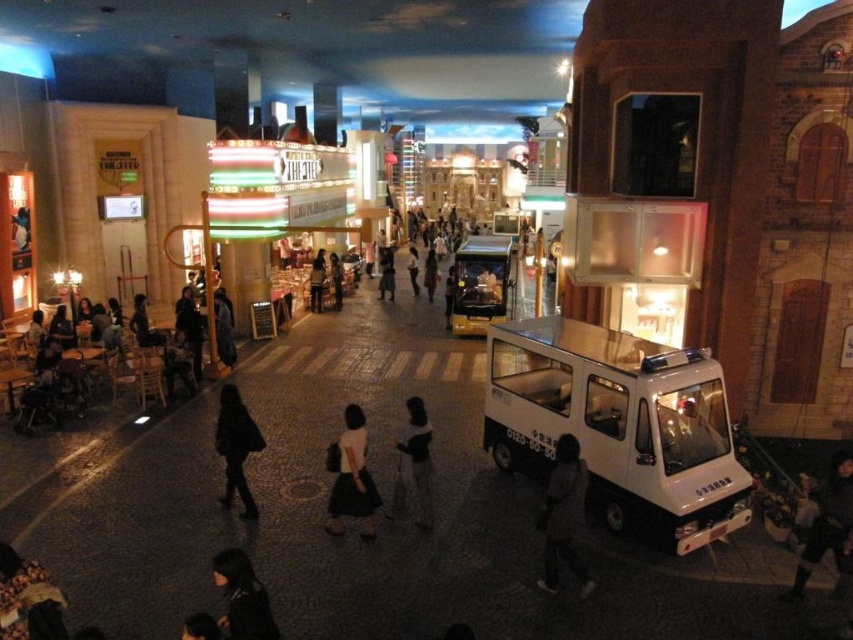
Question: Considering the real-world distances, which object is closest to the white plastic food truck at center?

Choices:
 (A) white matte skirt at center
 (B) black fabric dress at center
 (C) dark gray fabric jacket at lower right
 (D) black matte coat at center

Answer: (B)

Question: Does dark hair at lower center have a smaller size compared to dark gray fabric dress at center?

Choices:
 (A) yes
 (B) no

Answer: (A)

Question: Which object is the closest to the dark gray fabric jacket at lower right?

Choices:
 (A) white plastic food truck at lower right
 (B) white plastic food truck at center

Answer: (A)

Question: Estimate the real-world distances between objects in this image. Which object is farther from the white plastic food truck at lower right?

Choices:
 (A) white plastic food truck at center
 (B) smooth white van at center

Answer: (A)

Question: Can you confirm if white matte skirt at center is smaller than black fabric dress at center?

Choices:
 (A) yes
 (B) no

Answer: (A)

Question: Is smooth white van at center wider than black matte coat at center?

Choices:
 (A) yes
 (B) no

Answer: (A)